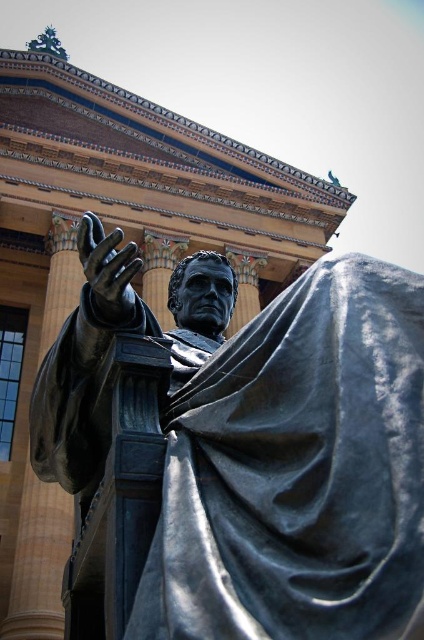
Question: Is bronze statue at center bigger than shiny bronze hand at center?

Choices:
 (A) yes
 (B) no

Answer: (B)

Question: Among these points, which one is farthest from the camera?

Choices:
 (A) 371,294
 (B) 84,243

Answer: (B)

Question: Is bronze statue at center below shiny bronze hand at center?

Choices:
 (A) no
 (B) yes

Answer: (B)

Question: In this image, where is bronze statue at center located relative to shiny bronze hand at center?

Choices:
 (A) right
 (B) left

Answer: (A)

Question: Among these objects, which one is farthest from the camera?

Choices:
 (A) shiny bronze hand at center
 (B) bronze statue at center

Answer: (A)